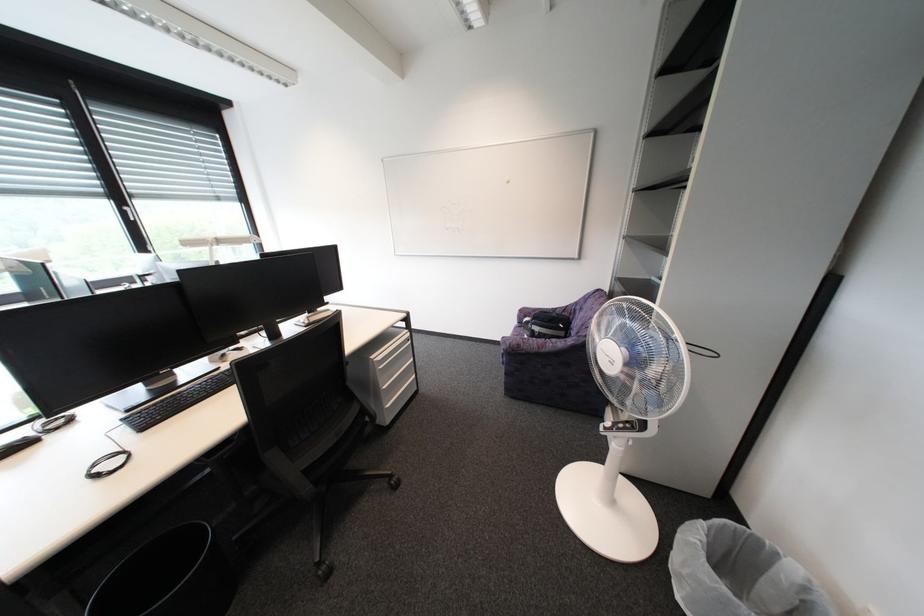
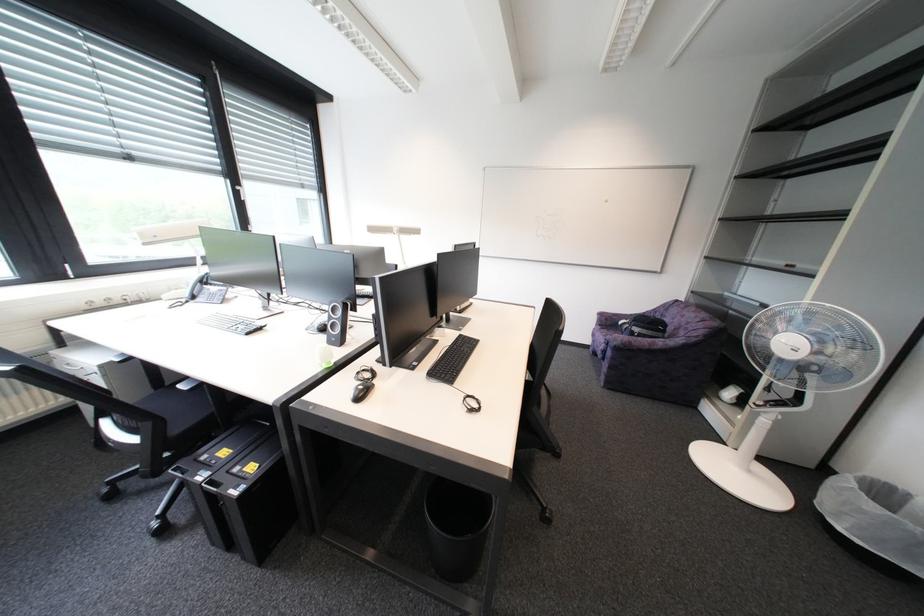
Question: What movement of the cameraman would produce the second image?

Choices:
 (A) Left
 (B) Right
 (C) Forward
 (D) Backward

Answer: (A)